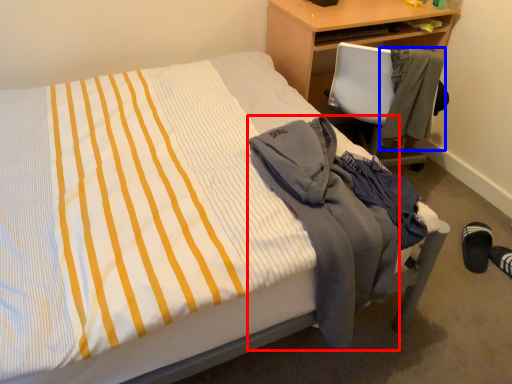
Question: Which of the following is the closest to the observer, jacket (highlighted by a red box) or jacket (highlighted by a blue box)?

Choices:
 (A) jacket
 (B) jacket

Answer: (A)